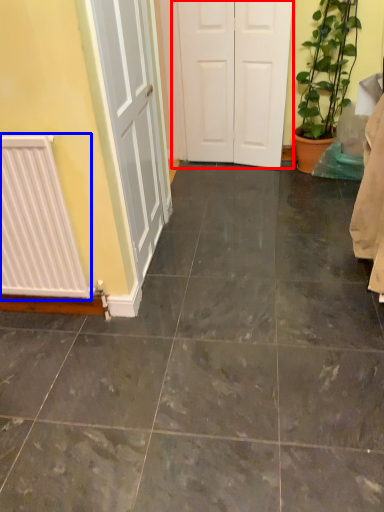
Question: Which point is further to the camera, door (highlighted by a red box) or radiator (highlighted by a blue box)?

Choices:
 (A) door
 (B) radiator

Answer: (A)